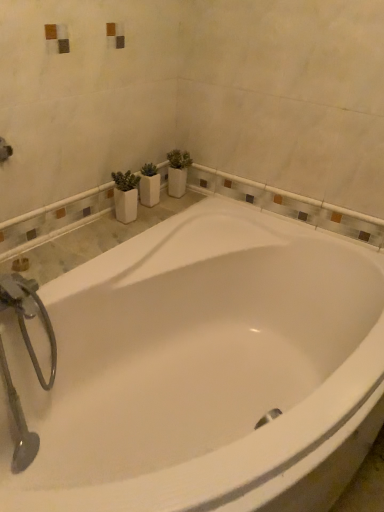
I want to click on white glossy bathtub at center, so coord(204,370).

What do you see at coordinates (204, 370) in the screenshot?
I see `white glossy bathtub at center` at bounding box center [204, 370].

You are a GUI agent. You are given a task and a screenshot of the screen. Output one action in this format:
    pyautogui.click(x=<x>, y=<y>)
    Task: Click on the white glossy bathtub at center
    The width and height of the screenshot is (384, 512).
    Given the screenshot: What is the action you would take?
    pyautogui.click(x=204, y=370)